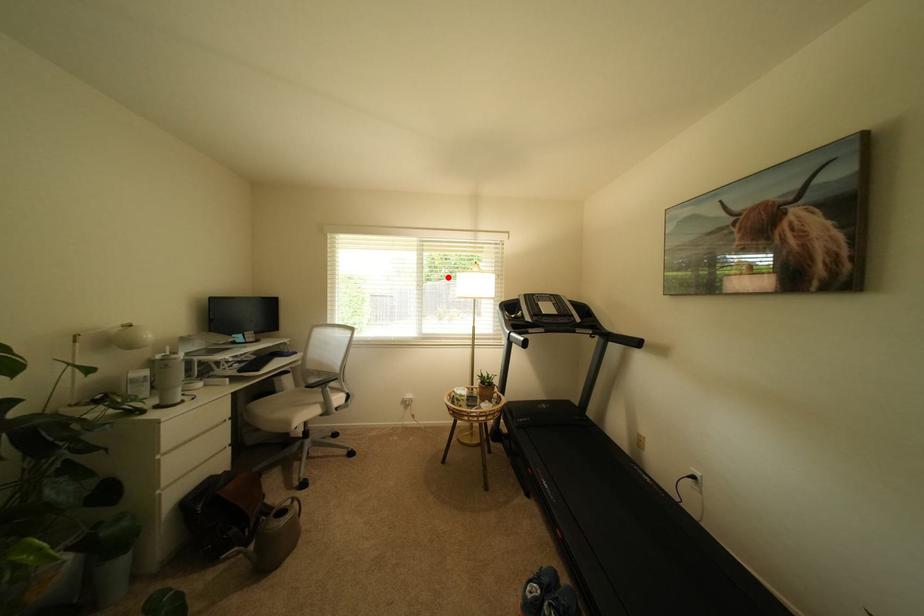
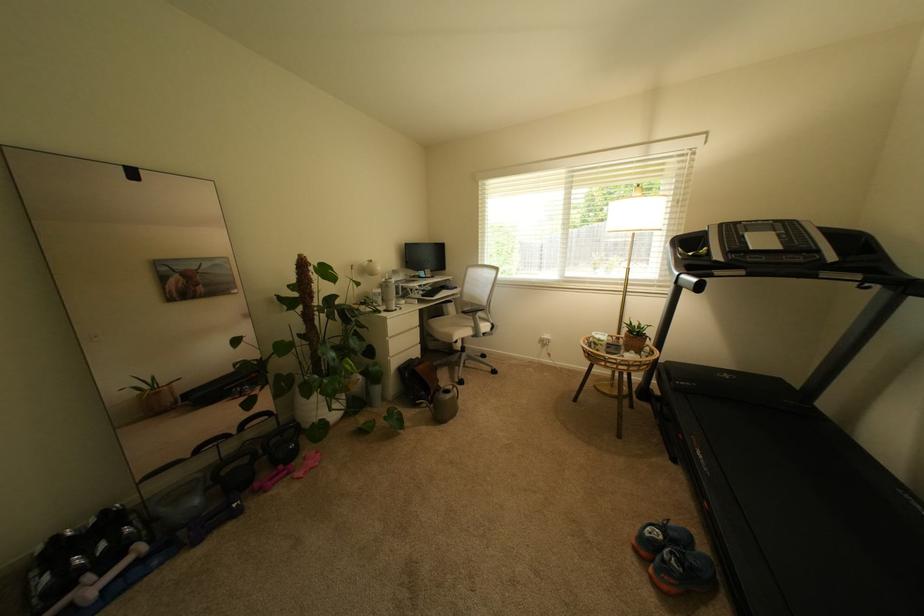
Question: I am providing you with two images of the same scene from different viewpoints. Image1 has a red point marked. In image2, the corresponding 3D location appears at what relative position? Reply with the corresponding letter.

Choices:
 (A) Closer
 (B) Farther

Answer: (A)